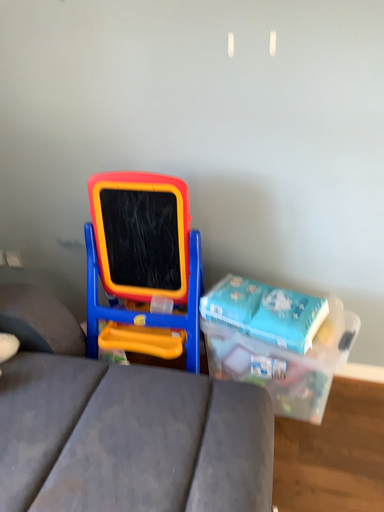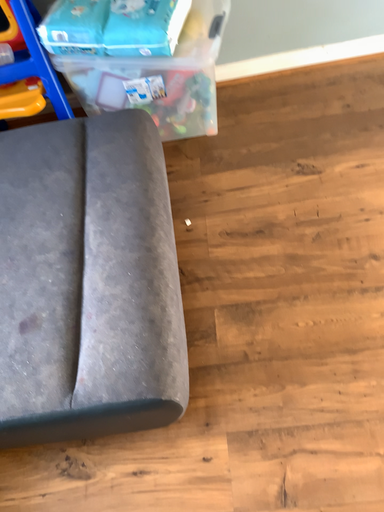
Question: Which way did the camera rotate in the video?

Choices:
 (A) rotated upward
 (B) rotated downward

Answer: (B)